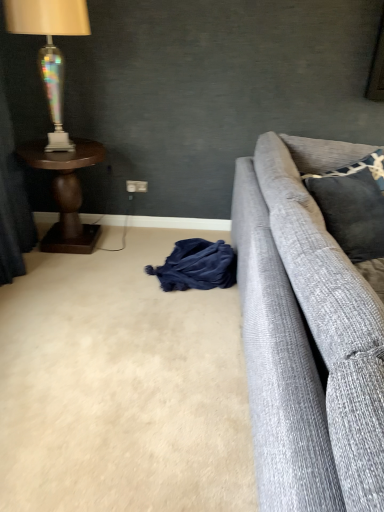
Question: Visually, is velvet dark blue curtain at left positioned to the left or to the right of dark blue fabric at lower center?

Choices:
 (A) right
 (B) left

Answer: (B)

Question: From their relative heights in the image, would you say velvet dark blue curtain at left is taller or shorter than dark blue fabric at lower center?

Choices:
 (A) short
 (B) tall

Answer: (B)

Question: Based on their relative distances, which object is farther from the dark gray fabric pillow at upper right, arranged as the second pillow when ordered from the bottom?

Choices:
 (A) iridescent glass lamp at left
 (B) dark gray textured pillow at right, marked as the 2th pillow in a top-to-bottom arrangement
 (C) dark brown wood side table at left
 (D) white plastic power outlet at center
 (E) velvet dark blue curtain at left

Answer: (E)

Question: Which of these objects is positioned closest to the dark blue fabric at lower center?

Choices:
 (A) velvet dark blue curtain at left
 (B) dark gray textured pillow at right, marked as the 2th pillow in a top-to-bottom arrangement
 (C) beige carpet at lower left
 (D) dark brown wood side table at left
 (E) iridescent glass lamp at left

Answer: (C)